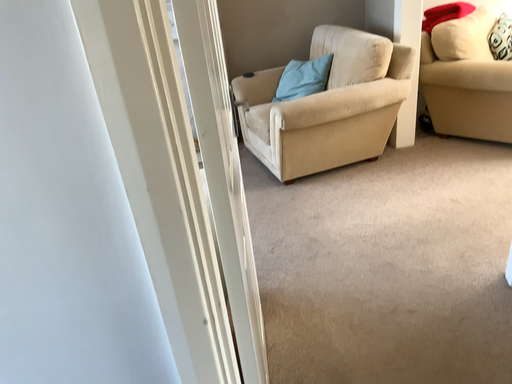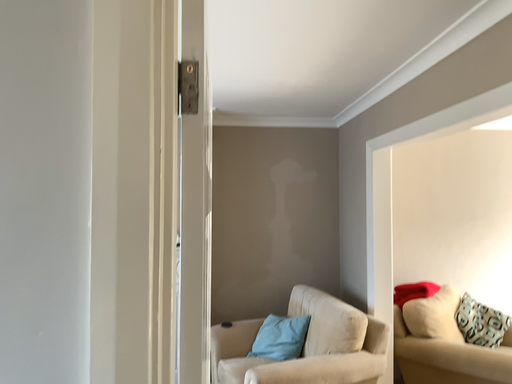
Question: Which way did the camera rotate in the video?

Choices:
 (A) rotated upward
 (B) rotated downward

Answer: (A)